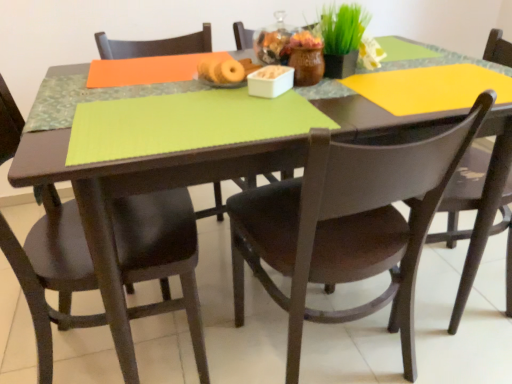
Based on the photo, in order to face matte black chair at right, positioned as the 3th chair in left-to-right order, should I rotate leftwards or rightwards?

You should rotate right by 23.945 degrees.

The image size is (512, 384). Describe the element at coordinates (480, 212) in the screenshot. I see `matte black chair at right, the first chair from the right` at that location.

What do you see at coordinates (52, 271) in the screenshot? I see `matte black chair at left, which is the 3th chair in right-to-left order` at bounding box center [52, 271].

The image size is (512, 384). Identify the location of matte black chair at left, the 1th chair in the left-to-right sequence. [x=52, y=271].

Locate an element on the screen. This screenshot has width=512, height=384. matte black chair at right, the first chair from the right is located at coordinates (480, 212).

Which is more distant, (x=497, y=122) or (x=324, y=25)?

The point (x=324, y=25) is behind.

From the image's perspective, is matte black chair at right, the first chair from the right, above green matte plant at upper center?

No.

Which is more to the right, matte black chair at right, the first chair from the right, or green matte plant at upper center?

Positioned to the right is matte black chair at right, the first chair from the right.

From the image's perspective, would you say green matte plant at upper center is positioned over matte black chair at center, positioned as the 2th chair in right-to-left order?

Yes, from the image's perspective, green matte plant at upper center is over matte black chair at center, positioned as the 2th chair in right-to-left order.

In the image, is green matte plant at upper center positioned in front of or behind matte black chair at center, which is the 2th chair from left to right?

Clearly, green matte plant at upper center is behind matte black chair at center, which is the 2th chair from left to right.

Is green matte plant at upper center with matte black chair at center, positioned as the 2th chair in right-to-left order?

There is a gap between green matte plant at upper center and matte black chair at center, positioned as the 2th chair in right-to-left order.

In the image, there is a matte black chair at center, positioned as the 2th chair in right-to-left order. Identify the location of plant above it (from the image's perspective). Image resolution: width=512 pixels, height=384 pixels. (342, 28).

Is matte black chair at center, positioned as the 2th chair in right-to-left order, turned away from green matte plant at upper center?

No, matte black chair at center, positioned as the 2th chair in right-to-left order, is not facing the opposite direction of green matte plant at upper center.

Which is more to the left, matte black chair at center, positioned as the 2th chair in right-to-left order, or green matte plant at upper center?

green matte plant at upper center is more to the left.

From a real-world perspective, which is physically below, matte black chair at center, positioned as the 2th chair in right-to-left order, or green matte plant at upper center?

In real-world perspective, matte black chair at center, positioned as the 2th chair in right-to-left order, is lower.

How different are the orientations of matte black chair at center, positioned as the 2th chair in right-to-left order, and green matte plant at upper center in degrees?

159 degrees.

Is matte black chair at center, which is the 2th chair from left to right, placed right next to matte black chair at left, the 1th chair in the left-to-right sequence?

No, matte black chair at center, which is the 2th chair from left to right, is not with matte black chair at left, the 1th chair in the left-to-right sequence.

From the picture: Between matte black chair at center, which is the 2th chair from left to right, and matte black chair at left, which is the 3th chair in right-to-left order, which one has larger width?

With larger width is matte black chair at left, which is the 3th chair in right-to-left order.

Find the location of `chair on the left of matte black chair at center, positioned as the 2th chair in right-to-left order`. chair on the left of matte black chair at center, positioned as the 2th chair in right-to-left order is located at coordinates (52, 271).

From the image's perspective, is matte black chair at right, positioned as the 3th chair in left-to-right order, on matte black chair at left, which is the 3th chair in right-to-left order?

Yes.

Who is shorter, matte black chair at right, the first chair from the right, or matte black chair at left, which is the 3th chair in right-to-left order?

matte black chair at left, which is the 3th chair in right-to-left order.

Can you tell me how much matte black chair at right, positioned as the 3th chair in left-to-right order, and matte black chair at left, which is the 3th chair in right-to-left order, differ in facing direction?

178 degrees separate the facing orientations of matte black chair at right, positioned as the 3th chair in left-to-right order, and matte black chair at left, which is the 3th chair in right-to-left order.

Is matte black chair at right, positioned as the 3th chair in left-to-right order, next to matte black chair at left, which is the 3th chair in right-to-left order?

No, matte black chair at right, positioned as the 3th chair in left-to-right order, is not next to matte black chair at left, which is the 3th chair in right-to-left order.

Relative to matte black chair at right, positioned as the 3th chair in left-to-right order, is matte black chair at left, the 1th chair in the left-to-right sequence, in front or behind?

matte black chair at left, the 1th chair in the left-to-right sequence, is positioned closer to the viewer than matte black chair at right, positioned as the 3th chair in left-to-right order.

Which chair is the 2nd one when counting from the right side of the matte black chair at left, which is the 3th chair in right-to-left order? Please provide its 2D coordinates.

[(480, 212)]

Which object is thinner, matte black chair at left, the 1th chair in the left-to-right sequence, or matte black chair at right, the first chair from the right?

Thinner between the two is matte black chair at right, the first chair from the right.

From the image's perspective, would you say matte black chair at left, which is the 3th chair in right-to-left order, is positioned over matte black chair at right, positioned as the 3th chair in left-to-right order?

Actually, matte black chair at left, which is the 3th chair in right-to-left order, appears below matte black chair at right, positioned as the 3th chair in left-to-right order, in the image.

Between point (353, 8) and point (498, 61), which one is positioned behind?

The point (498, 61) is farther from the camera.

Is green matte plant at upper center bigger than matte black chair at right, positioned as the 3th chair in left-to-right order?

No, green matte plant at upper center is not bigger than matte black chair at right, positioned as the 3th chair in left-to-right order.

Is green matte plant at upper center in contact with matte black chair at right, positioned as the 3th chair in left-to-right order?

They are not placed beside each other.

This screenshot has height=384, width=512. In order to click on the 1st chair in front of the green matte plant at upper center, counting from the anchor's position in this screenshot , I will do `click(480, 212)`.

You are a GUI agent. You are given a task and a screenshot of the screen. Output one action in this format:
    pyautogui.click(x=<x>, y=<y>)
    Task: Click on the 1st chair counting from the right side of the green matte plant at upper center
    This screenshot has height=384, width=512.
    Given the screenshot: What is the action you would take?
    pyautogui.click(x=347, y=226)

Considering their positions, is green matte plant at upper center positioned further to matte black chair at left, which is the 3th chair in right-to-left order, than matte black chair at center, which is the 2th chair from left to right?

green matte plant at upper center lies further to matte black chair at left, which is the 3th chair in right-to-left order, than the other object.

Looking at the image, which one is located further to green matte plant at upper center, matte black chair at right, the first chair from the right, or matte black chair at center, which is the 2th chair from left to right?

matte black chair at right, the first chair from the right.

Which object lies further to the anchor point green matte plant at upper center, matte black chair at right, positioned as the 3th chair in left-to-right order, or matte black chair at left, which is the 3th chair in right-to-left order?

matte black chair at left, which is the 3th chair in right-to-left order, lies further to green matte plant at upper center than the other object.

When comparing their distances from matte black chair at left, the 1th chair in the left-to-right sequence, does matte black chair at center, positioned as the 2th chair in right-to-left order, or matte black chair at right, the first chair from the right, seem further?

Among the two, matte black chair at right, the first chair from the right, is located further to matte black chair at left, the 1th chair in the left-to-right sequence.

Looking at the image, which one is located further to matte black chair at center, positioned as the 2th chair in right-to-left order, green matte plant at upper center or matte black chair at left, the 1th chair in the left-to-right sequence?

green matte plant at upper center is positioned further to the anchor matte black chair at center, positioned as the 2th chair in right-to-left order.

From the image, which object appears to be nearer to matte black chair at center, positioned as the 2th chair in right-to-left order, green matte plant at upper center or matte black chair at right, the first chair from the right?

Among the two, matte black chair at right, the first chair from the right, is located nearer to matte black chair at center, positioned as the 2th chair in right-to-left order.

Looking at the image, which one is located closer to matte black chair at right, positioned as the 3th chair in left-to-right order, matte black chair at left, which is the 3th chair in right-to-left order, or green matte plant at upper center?

green matte plant at upper center lies closer to matte black chair at right, positioned as the 3th chair in left-to-right order, than the other object.

Considering their positions, is matte black chair at left, which is the 3th chair in right-to-left order, positioned closer to matte black chair at center, positioned as the 2th chair in right-to-left order, than green matte plant at upper center?

Among the two, matte black chair at left, which is the 3th chair in right-to-left order, is located nearer to matte black chair at center, positioned as the 2th chair in right-to-left order.

What are the coordinates of `chair between green matte plant at upper center and matte black chair at center, which is the 2th chair from left to right, in the up-down direction` in the screenshot? It's located at (480, 212).

What are the coordinates of `chair between matte black chair at left, which is the 3th chair in right-to-left order, and matte black chair at right, the first chair from the right, in the horizontal direction` in the screenshot? It's located at (347, 226).

The image size is (512, 384). What are the coordinates of `plant located between matte black chair at left, the 1th chair in the left-to-right sequence, and matte black chair at center, positioned as the 2th chair in right-to-left order, in the left-right direction` in the screenshot? It's located at (342, 28).

Locate an element on the screen. plant located between matte black chair at left, the 1th chair in the left-to-right sequence, and matte black chair at right, the first chair from the right, in the left-right direction is located at coordinates (342, 28).